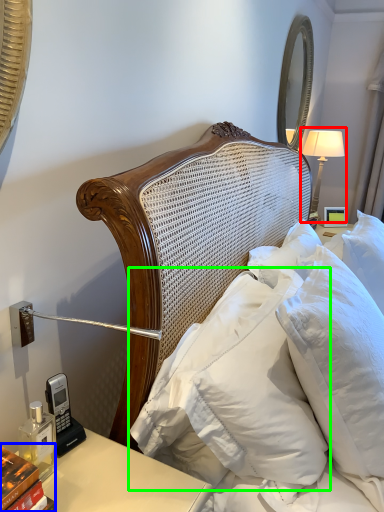
Question: Considering the real-world distances, which object is farthest from bedside lamp (highlighted by a red box)? book (highlighted by a blue box) or pillow (highlighted by a green box)?

Choices:
 (A) book
 (B) pillow

Answer: (A)